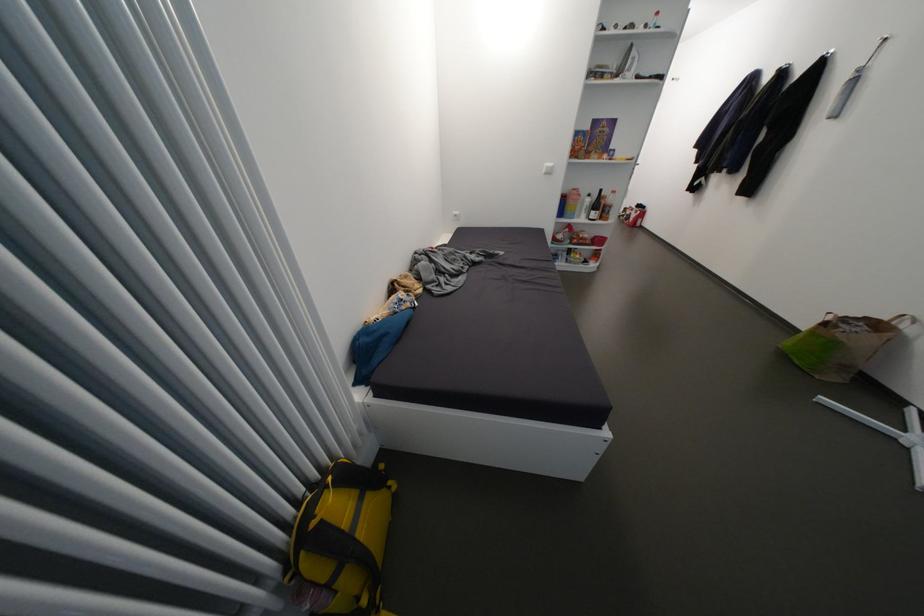
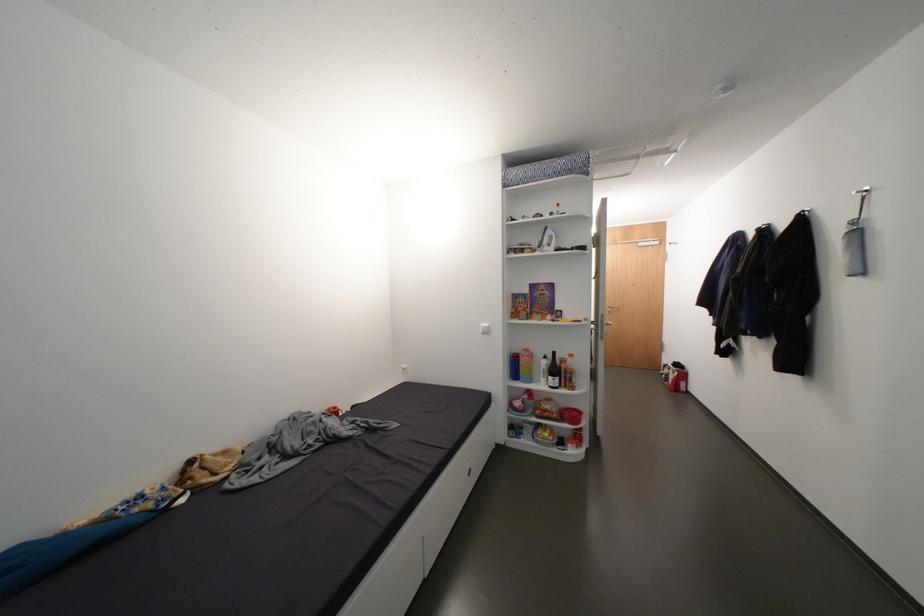
In the second image, find the point that corresponds to pixel 610 203 in the first image.

(570, 367)